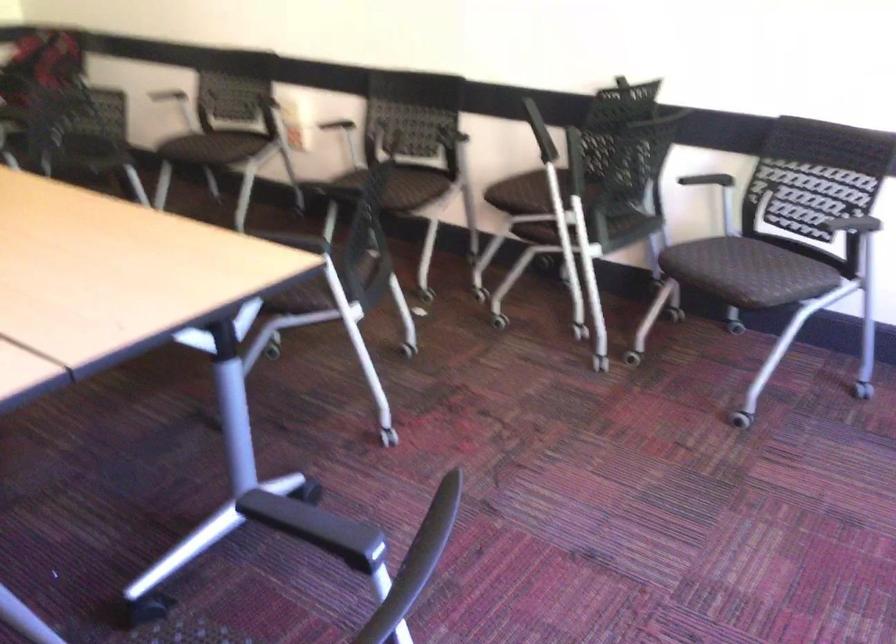
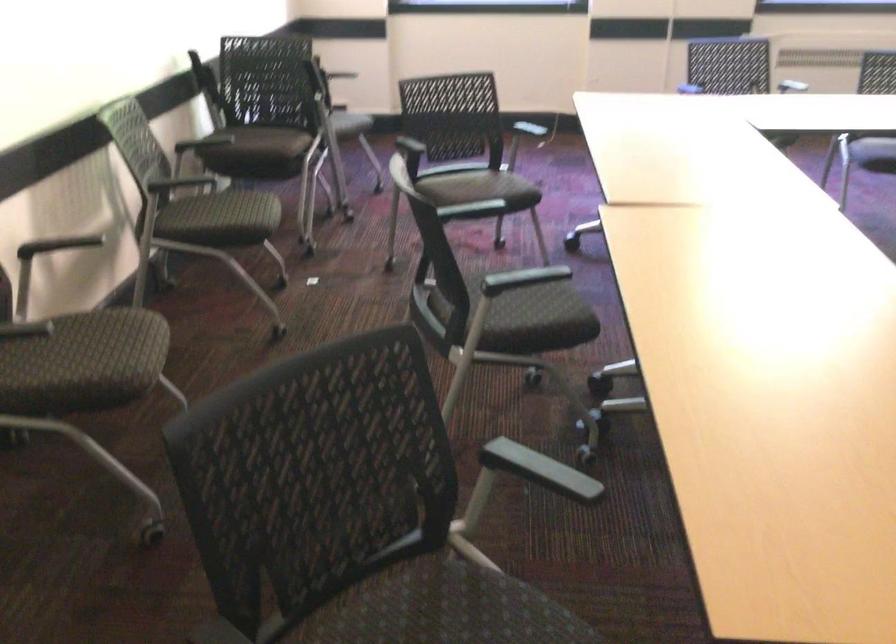
In the second image, find the point that corresponds to the point at 453,161 in the first image.

(168, 187)